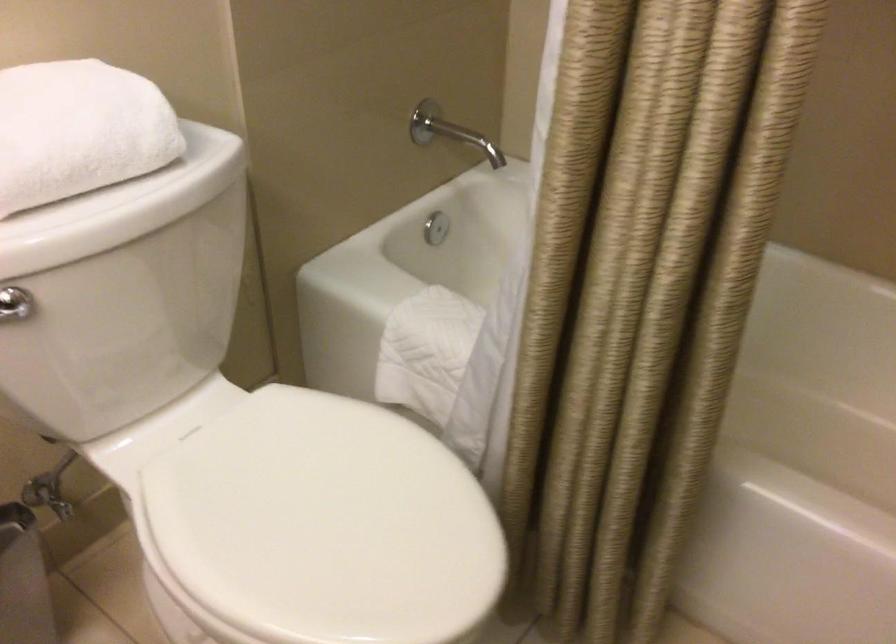
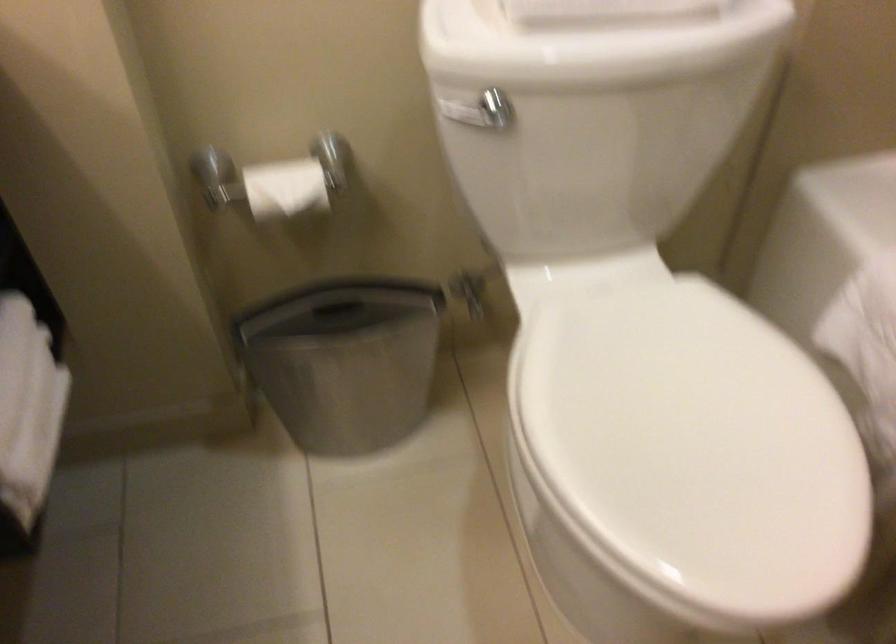
The images are taken continuously from a first-person perspective. In which direction is your viewpoint rotating?

The camera rotated toward left-down.